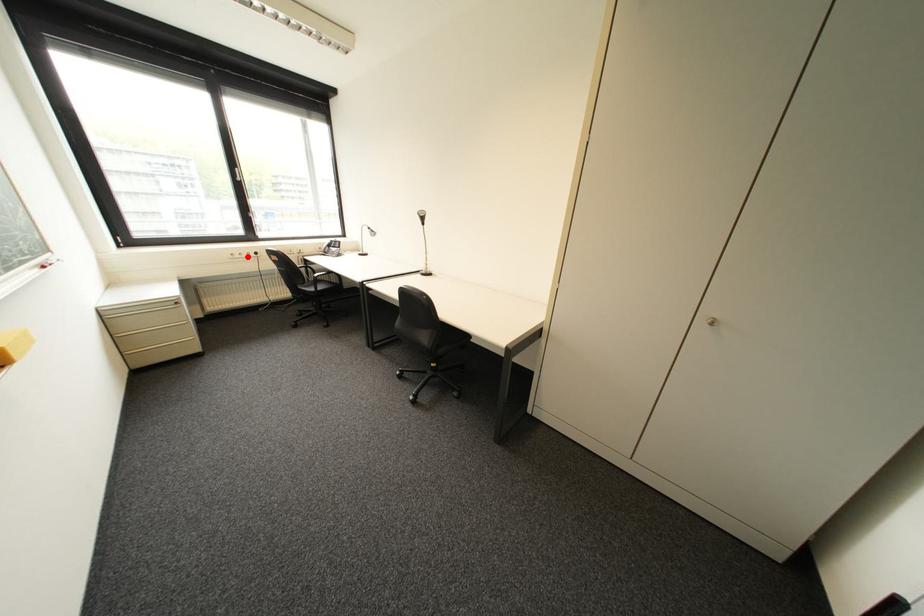
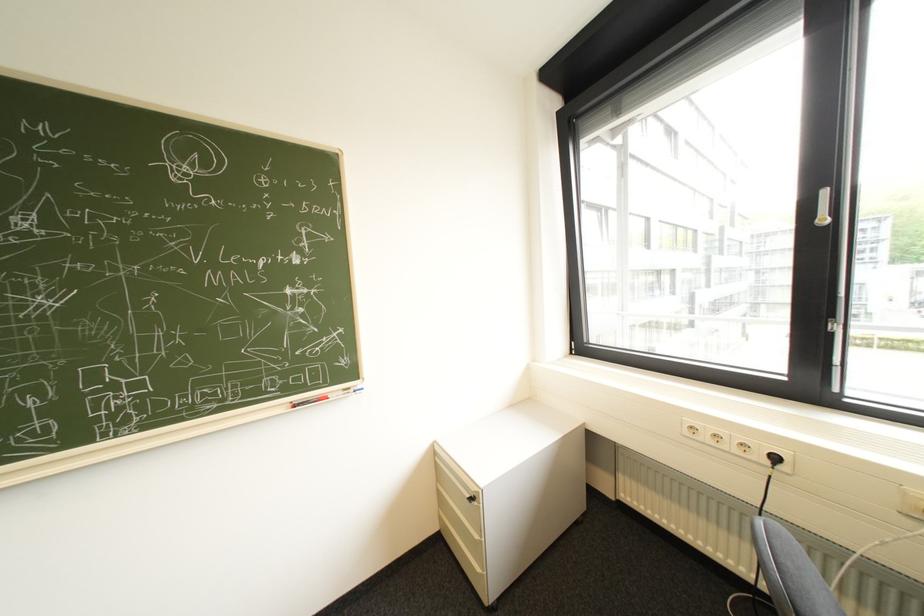
Where in the second image is the point corresponding to the highlighted location from the first image?

(715, 438)